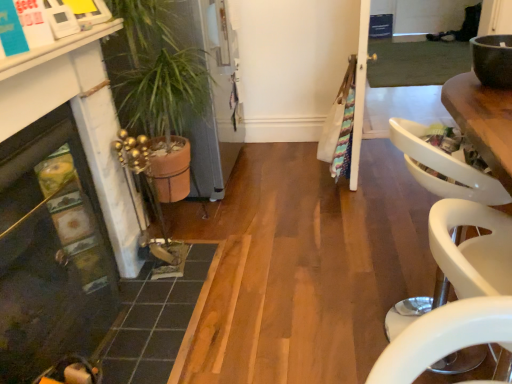
Locate an element on the screen. The image size is (512, 384). vacant region to the right of dark gray tile at lower left is located at coordinates (278, 286).